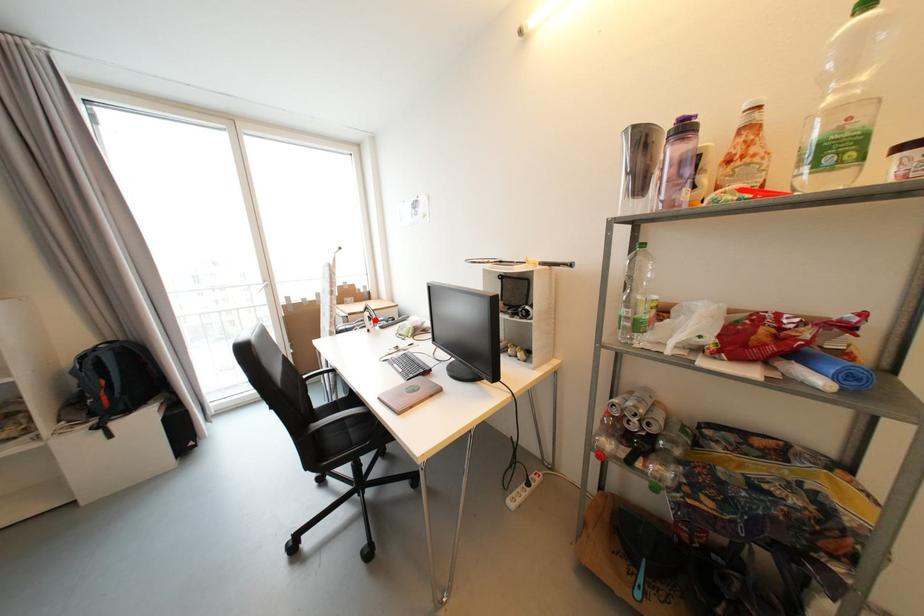
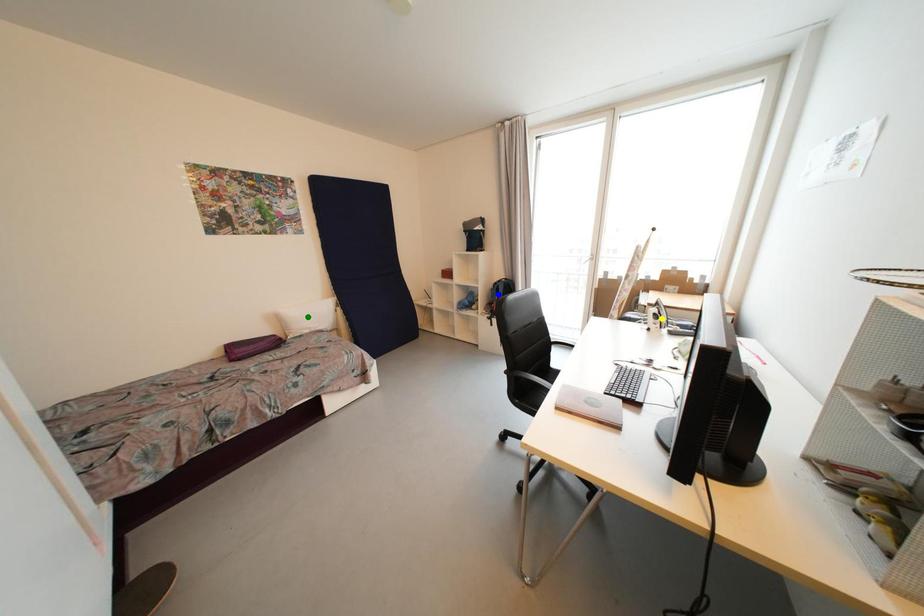
Question: I am providing you with two images of the same scene from different viewpoints. A red point is marked on the first image. You are given multiple points on the second image. Which mark in image 2 goes with the point in image 1?

Choices:
 (A) yellow point
 (B) blue point
 (C) green point

Answer: (A)